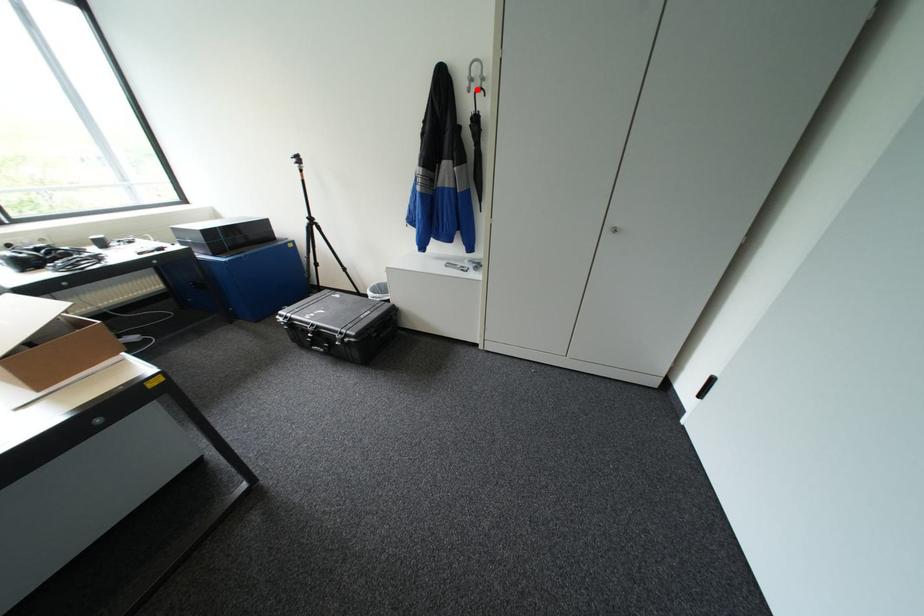
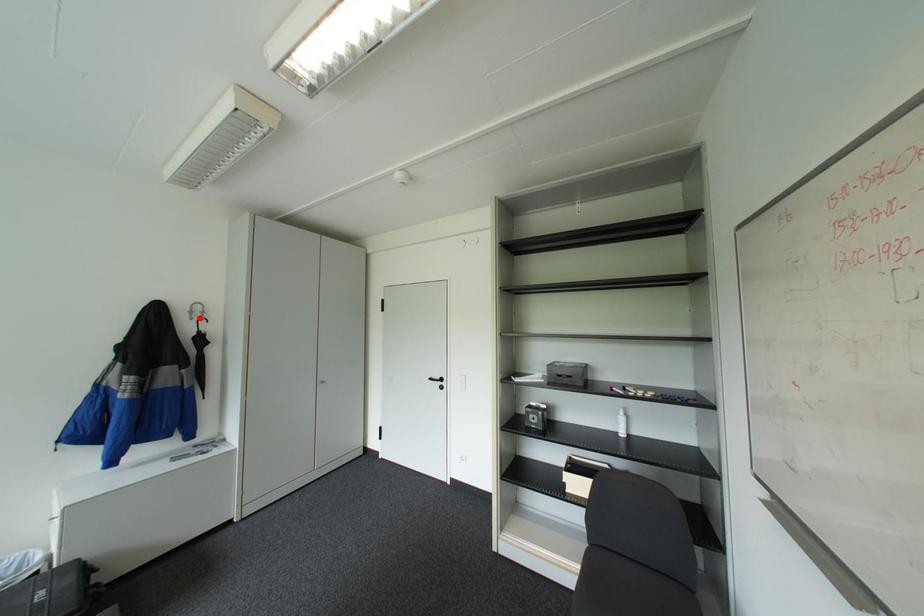
I am providing you with two images of the same scene from different viewpoints. A red point is marked on the first image and another point is marked on the second image. Does the point marked in image1 correspond to the same location as the one in image2?

Yes